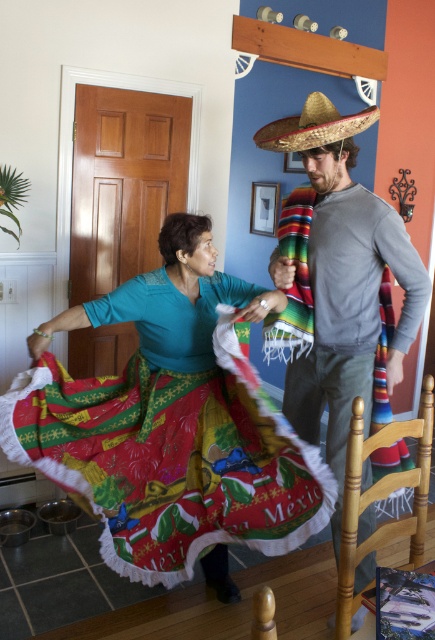
What are the coordinates of the gray cotton shirt at center?

The gray cotton shirt at center is located at point (337,284).

You are a costume designer preparing for a dance performance. You have a gray cotton shirt at center and a printed cotton skirt at center. Which clothing item has a smaller width?

The gray cotton shirt at center has a smaller width than the printed cotton skirt at center.